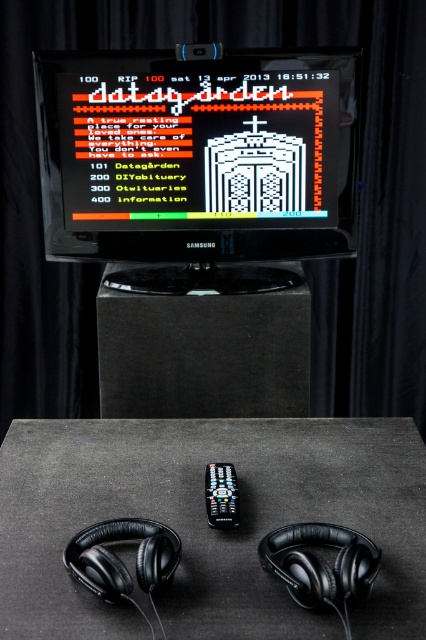
Can you confirm if black glossy monitor at center is wider than black plastic remote at center?

Correct, the width of black glossy monitor at center exceeds that of black plastic remote at center.

The image size is (426, 640). Describe the element at coordinates (198, 154) in the screenshot. I see `black glossy monitor at center` at that location.

This screenshot has width=426, height=640. I want to click on black glossy monitor at center, so click(x=198, y=154).

I want to click on black matte table at center, so click(207, 522).

Is point (239, 524) positioned behind point (227, 486)?

No, it is in front of (227, 486).

At what (x,y) coordinates should I click in order to perform the action: click on black matte table at center. Please return your answer as a coordinate pair (x, y). The image size is (426, 640). Looking at the image, I should click on (207, 522).

Does point (367, 564) come farther from viewer compared to point (230, 492)?

No, it is not.

Is the position of black matte headphones at lower center less distant than that of black plastic remote at center?

Yes, black matte headphones at lower center is closer to the viewer.

Who is more distant from viewer, (261, 563) or (210, 499)?

The point (210, 499) is more distant.

Locate an element on the screen. This screenshot has width=426, height=640. black matte headphones at lower center is located at coordinates (321, 563).